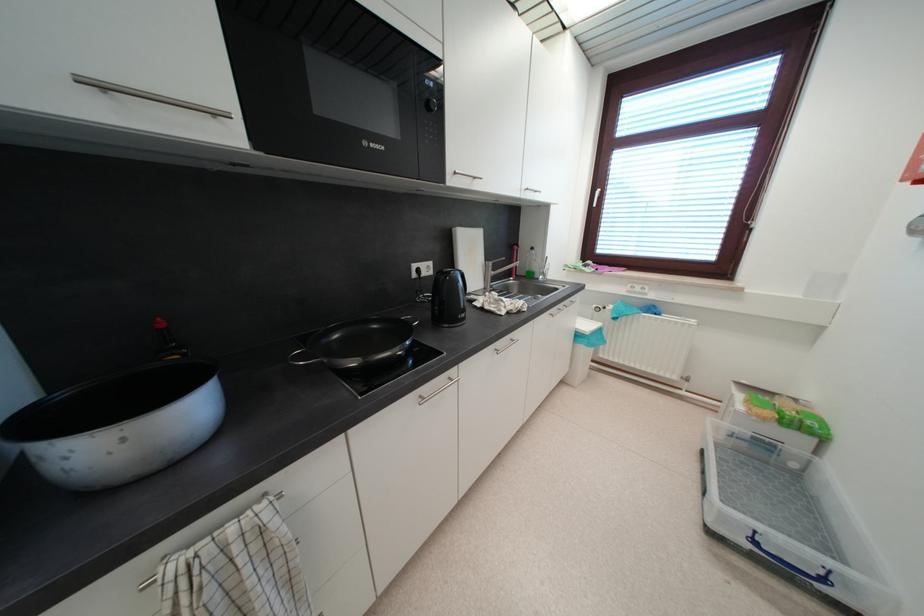
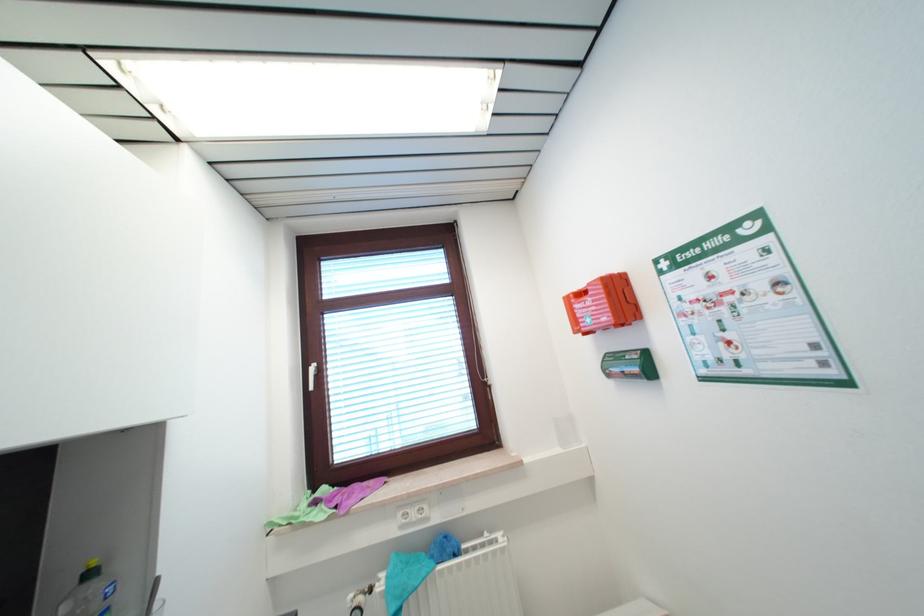
In the second image, find the point that corresponds to (614,310) in the first image.

(385, 589)